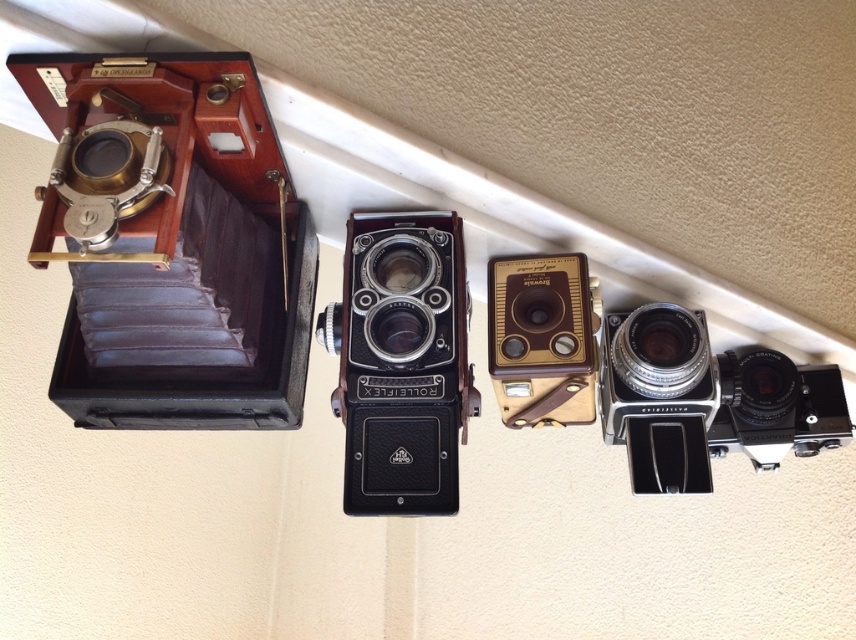
Question: Among these objects, which one is nearest to the camera?

Choices:
 (A) gold metallic camera at center
 (B) black matte rolleiflex at center
 (C) silver metallic camera at right

Answer: (B)

Question: Is the position of silver metallic camera at right less distant than that of gold metallic camera at center?

Choices:
 (A) yes
 (B) no

Answer: (B)

Question: Does silver metallic camera at right have a larger size compared to gold metallic camera at center?

Choices:
 (A) yes
 (B) no

Answer: (A)

Question: Does black matte rolleiflex at center have a lesser width compared to gold metallic camera at center?

Choices:
 (A) yes
 (B) no

Answer: (B)

Question: Which point is farther from the camera taking this photo?

Choices:
 (A) coord(403,292)
 (B) coord(520,259)
 (C) coord(599,387)

Answer: (C)

Question: Which point is closer to the camera taking this photo?

Choices:
 (A) (370, 412)
 (B) (753, 403)

Answer: (A)